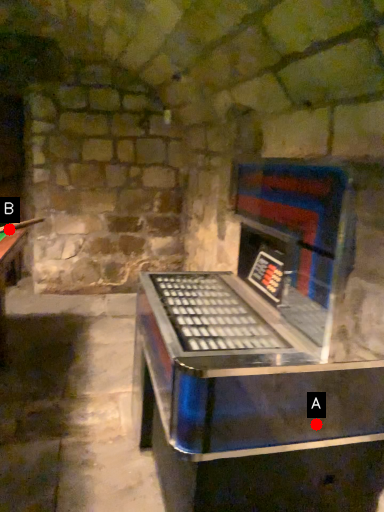
Question: Two points are circled on the image, labeled by A and B beside each circle. Which point is farther from the camera taking this photo?

Choices:
 (A) A is further
 (B) B is further

Answer: (B)